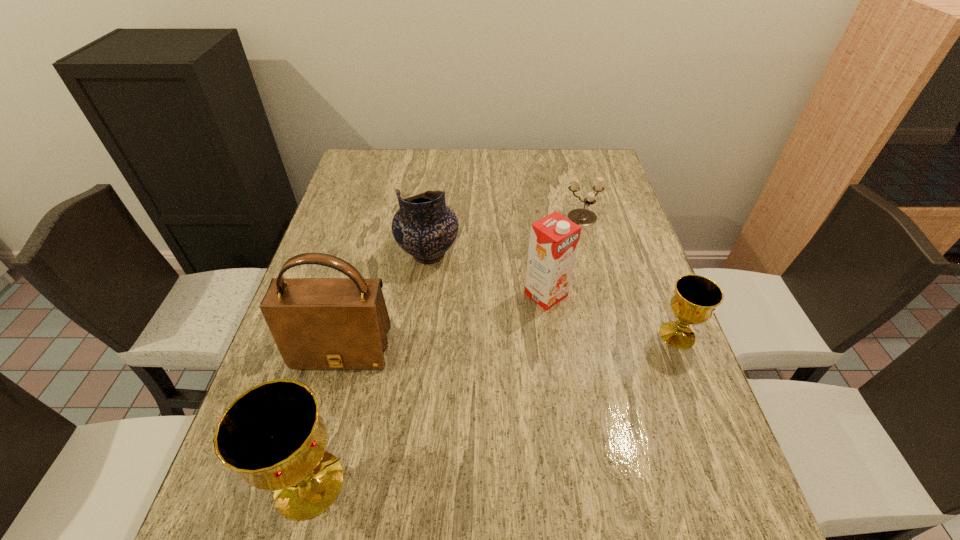
This screenshot has height=540, width=960. What are the coordinates of `the nearer chalice` in the screenshot? It's located at (272, 435).

Find the location of `the taller chalice`. the taller chalice is located at coordinates (272, 435).

Find the location of a particular element. the farther chalice is located at coordinates (695, 297).

The width and height of the screenshot is (960, 540). I want to click on the right chalice, so click(695, 297).

Find the location of a particular element. pottery is located at coordinates (425, 227).

Locate an element on the screen. The height and width of the screenshot is (540, 960). the fifth object from left to right is located at coordinates (583, 217).

Locate an element on the screen. candle holder is located at coordinates (583, 217).

I want to click on the fourth object from left to right, so click(554, 239).

Find the location of a particular element. Image resolution: width=960 pixels, height=540 pixels. the fourth nearest object is located at coordinates (554, 239).

This screenshot has height=540, width=960. I want to click on shoulder bag, so click(317, 323).